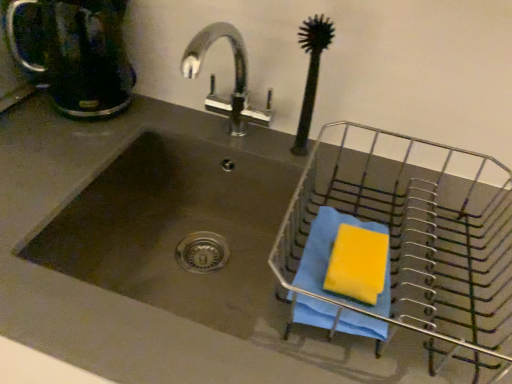
The image size is (512, 384). I want to click on vacant space to the right of blue cloth at right, so click(x=445, y=290).